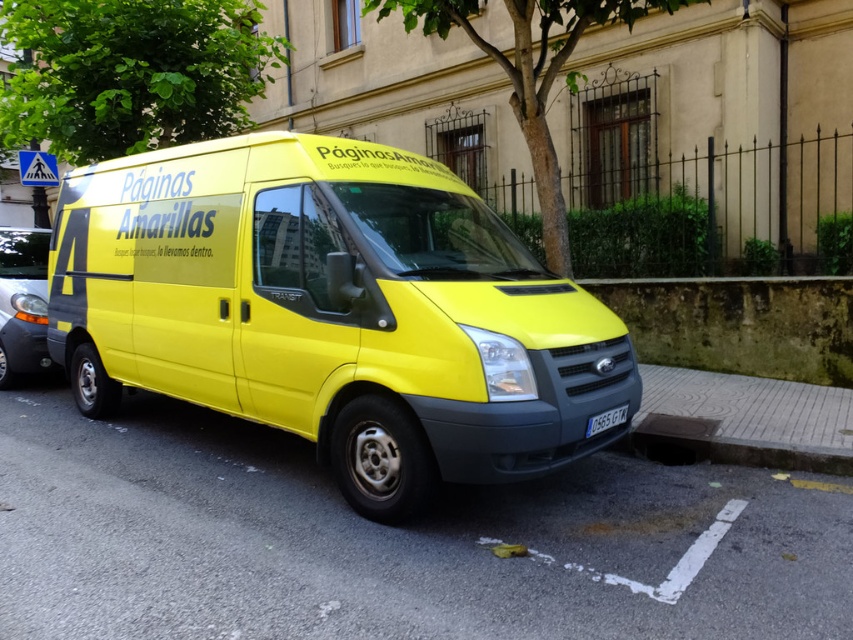
Question: Is yellow matte van at center bigger than yellow matte license plate at center?

Choices:
 (A) yes
 (B) no

Answer: (A)

Question: Can you confirm if yellow matte van at center is wider than yellow matte license plate at center?

Choices:
 (A) yes
 (B) no

Answer: (A)

Question: Which point is farther from the camera taking this photo?

Choices:
 (A) (308, 285)
 (B) (614, 412)
 (C) (32, 339)

Answer: (C)

Question: Which of these objects is positioned farthest from the yellow matte license plate at center?

Choices:
 (A) yellow matte van at center
 (B) metallic gray car at left

Answer: (B)

Question: Can you confirm if yellow matte van at center is wider than yellow matte license plate at center?

Choices:
 (A) no
 (B) yes

Answer: (B)

Question: Estimate the real-world distances between objects in this image. Which object is closer to the metallic gray car at left?

Choices:
 (A) yellow matte van at center
 (B) yellow matte license plate at center

Answer: (A)